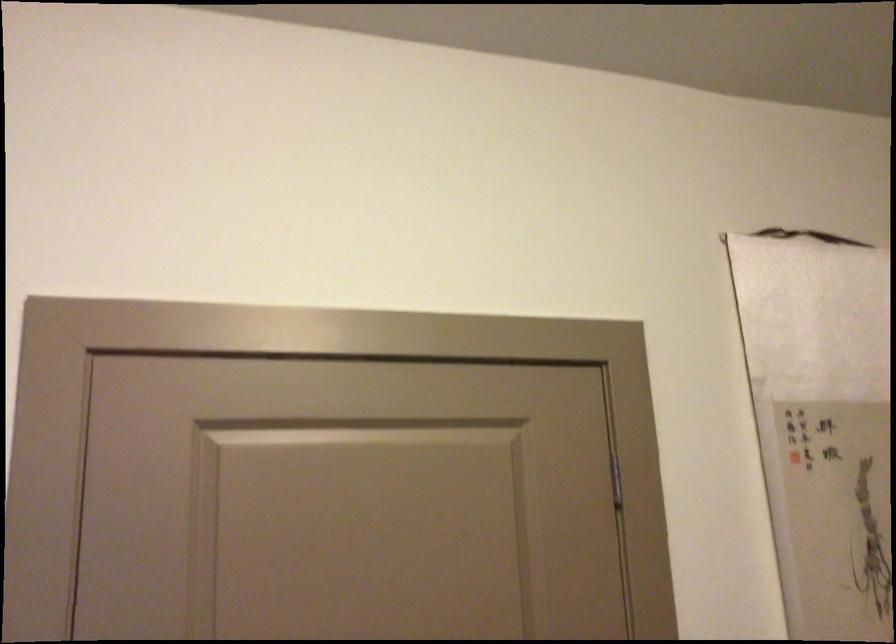
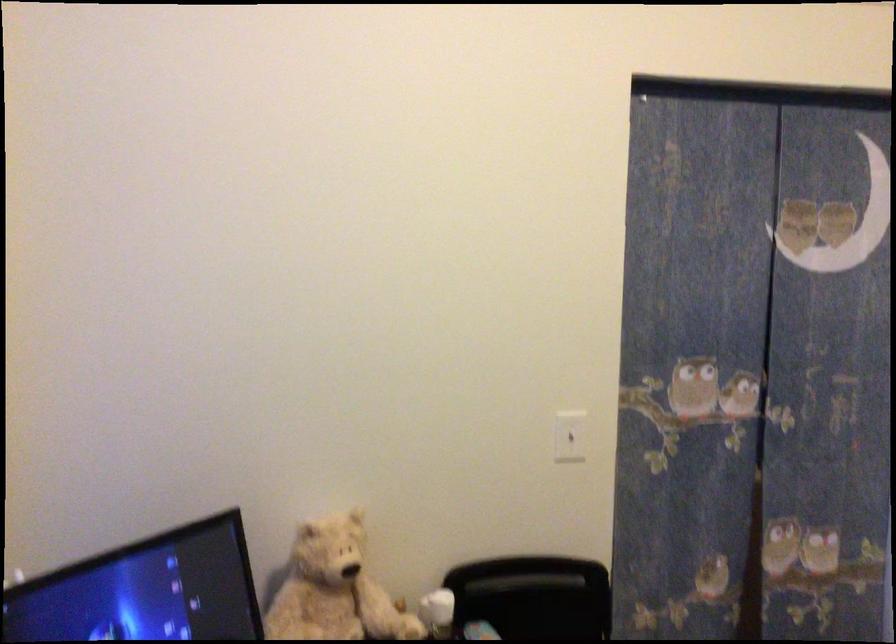
Question: How did the camera likely rotate?

Choices:
 (A) Left
 (B) Right
 (C) Up
 (D) Down

Answer: (A)